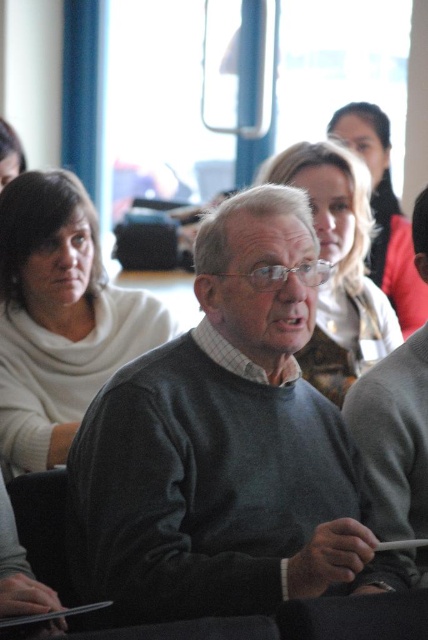
You are organizing a clothing display and need to arrange the white sweater at left and the smooth beige sweater at center based on their sizes. Which sweater should you place on the lower shelf if the lower shelf is for smaller items?

The white sweater at left has a lesser height compared to the smooth beige sweater at center, so it should be placed on the lower shelf for smaller items.

You are an interior designer analyzing the image. You need to determine the color of the sweater worn by the person at the center of the image. According to the coordinates provided, what color is the matte sweater located at point (338, 266)?

The point at (338, 266) indicates the matte beige sweater at center, so the sweater is beige.

You are standing in the room where the meeting is taking place and want to hand a document to the person wearing the white sweater at left. Based on their position, can you estimate if they are sitting to your left or right side?

The white sweater at left is located at point (x=59, y=317), which means they are sitting to your left side.